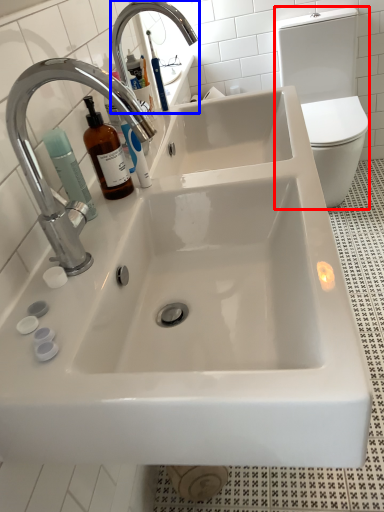
Question: Which of the following is the farthest to the observer, toilet bowl (highlighted by a red box) or tap (highlighted by a blue box)?

Choices:
 (A) toilet bowl
 (B) tap

Answer: (A)